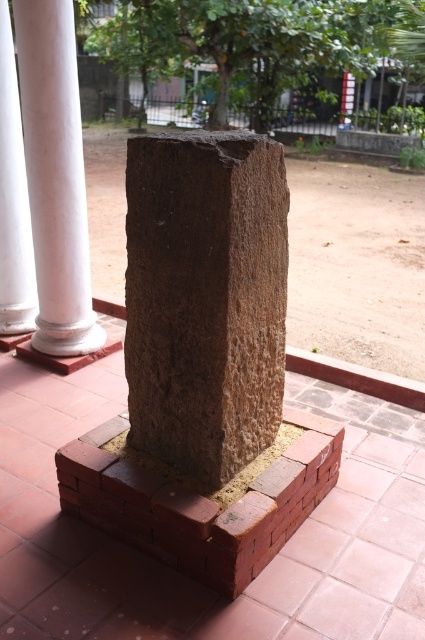
Question: Which of the following is the closest to the observer?

Choices:
 (A) white smooth column at left
 (B) red brick at center

Answer: (B)

Question: Can you confirm if brown rough stone pillar at center is positioned to the left of white smooth column at left?

Choices:
 (A) no
 (B) yes

Answer: (A)

Question: Which point appears closest to the camera in this image?

Choices:
 (A) (39, 413)
 (B) (193, 545)

Answer: (B)

Question: Is smooth white column at center thinner than white smooth column at left?

Choices:
 (A) yes
 (B) no

Answer: (B)

Question: Does brown rough stone pillar at center have a smaller size compared to white smooth column at left?

Choices:
 (A) yes
 (B) no

Answer: (B)

Question: Which of the following is the farthest from the observer?

Choices:
 (A) (271, 323)
 (B) (286, 474)
 (C) (23, 326)

Answer: (C)